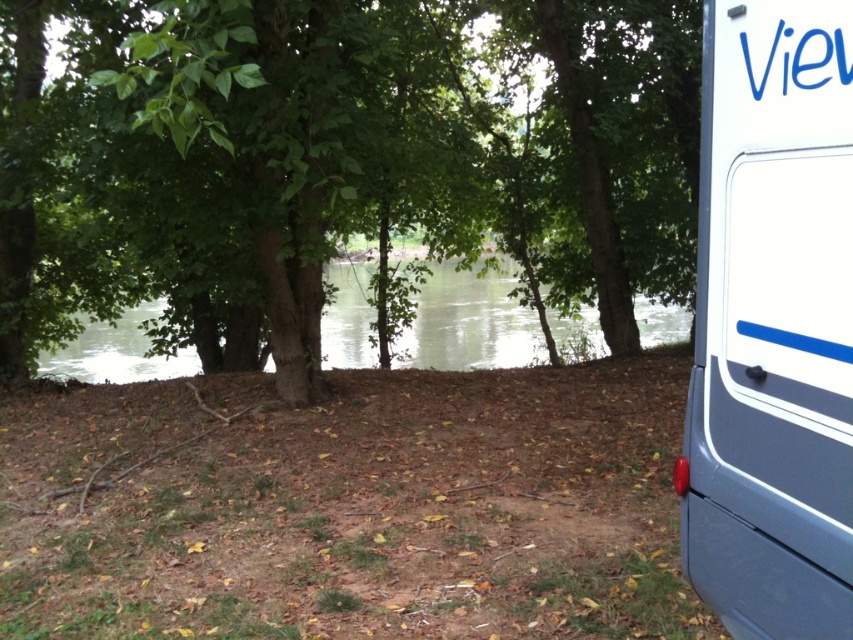
Question: Can you confirm if green leafy tree at center is thinner than green water at center?

Choices:
 (A) yes
 (B) no

Answer: (A)

Question: Among these points, which one is farthest from the camera?

Choices:
 (A) (572, 333)
 (B) (695, 358)

Answer: (A)

Question: Is green leafy tree at center to the right of green water at center from the viewer's perspective?

Choices:
 (A) yes
 (B) no

Answer: (A)

Question: Which object appears farthest from the camera in this image?

Choices:
 (A) green water at center
 (B) green leafy tree at center

Answer: (A)

Question: Estimate the real-world distances between objects in this image. Which object is farther from the green water at center?

Choices:
 (A) white glossy van at right
 (B) green leafy tree at center

Answer: (A)

Question: Does white glossy van at right appear on the left side of green water at center?

Choices:
 (A) no
 (B) yes

Answer: (A)